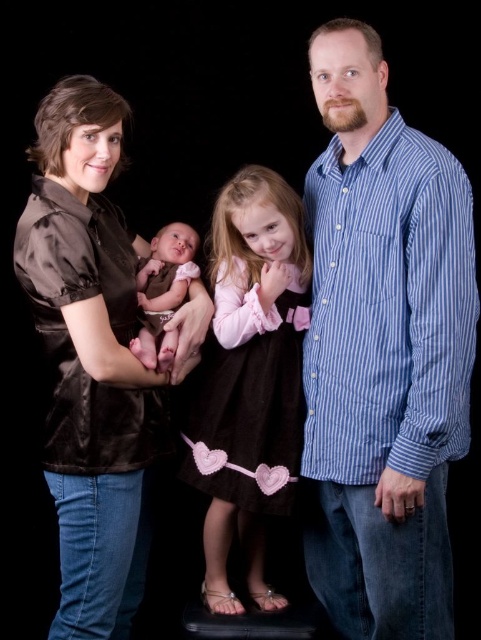
You are a photographer adjusting the lighting for a family portrait. You need to ensure that the matte brown dress at center and the smooth pink fabric at center are evenly lit. Given that the distance between them is 10.96 inches, what should you consider when positioning your lights to achieve even illumination?

The distance between the matte brown dress at center and the smooth pink fabric at center is 10.96 inches. To achieve even illumination, you should position the lights equidistant from both objects, ensuring that the light falls uniformly on both the matte brown dress at center and the smooth pink fabric at center. This will help balance the lighting and prevent one area from being overly bright or shadowed compared to the other.

You are a fashion designer observing the family portrait. You need to determine which item of clothing, the satin brown blouse at left or the matte brown dress at center, requires more fabric to produce. Based on the image, which one would you choose?

The satin brown blouse at left is larger in size than the matte brown dress at center, so it would require more fabric to produce.

You are a photographer standing 1.5 meters away from the camera. You want to adjust your position so that you can clearly see the blue striped shirt at center in the viewfinder. Should you move closer to or farther away from the camera?

The blue striped shirt at center is 1.44 meters away from the camera. Since you are currently 1.5 meters away from the camera, you need to move closer by 0.06 meters to be at the same distance as the blue striped shirt at center for a clear view.